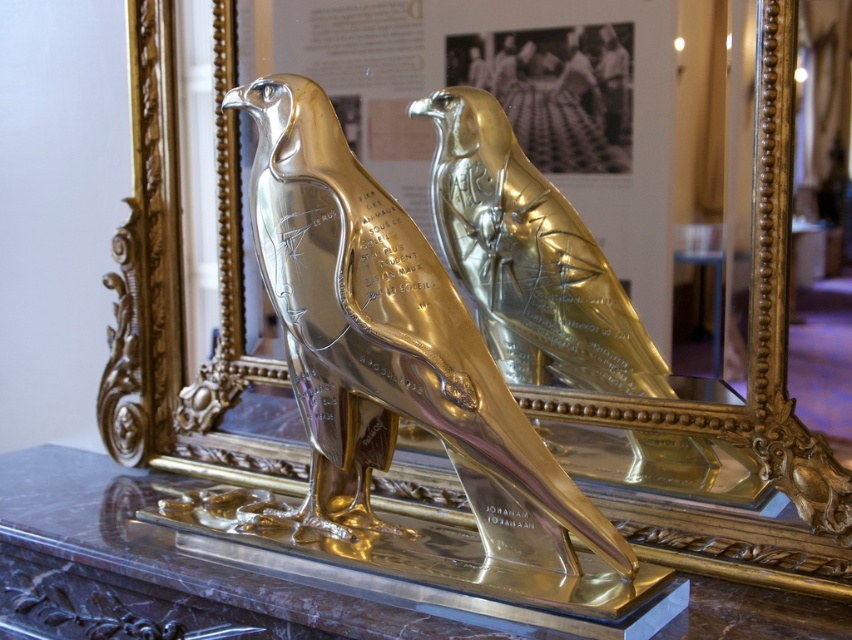
Which is in front, point (330, 272) or point (542, 364)?

Point (330, 272) is more forward.

Between shiny gold bird at center and gold polished eagle at center, which one is positioned lower?

shiny gold bird at center

The width and height of the screenshot is (852, 640). I want to click on shiny gold bird at center, so click(390, 346).